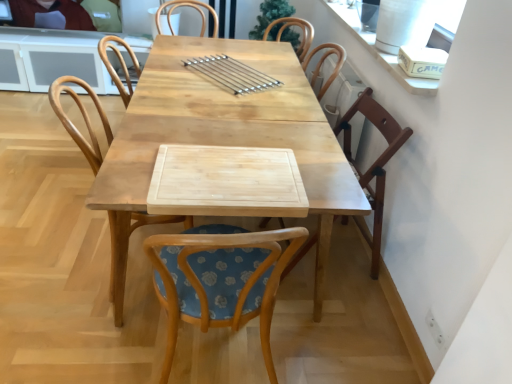
Question: Which direction should I rotate to look at wooden chair at center, which is the third chair from right to left?

Choices:
 (A) left
 (B) right

Answer: (A)

Question: Considering the relative sizes of wooden chair at center, which is the third chair from right to left, and woodenchair at center, which is the 2th chair in left-to-right order, in the image provided, is wooden chair at center, which is the third chair from right to left, smaller than woodenchair at center, which is the 2th chair in left-to-right order,?

Choices:
 (A) no
 (B) yes

Answer: (A)

Question: Can you confirm if wooden chair at center, which is the third chair from right to left, is wider than woodenchair at center, which is counted as the 2th chair, starting from the right?

Choices:
 (A) yes
 (B) no

Answer: (B)

Question: Is wooden chair at center, which is the third chair from right to left, not within woodenchair at center, which is counted as the 2th chair, starting from the right?

Choices:
 (A) yes
 (B) no

Answer: (A)

Question: From a real-world perspective, is wooden chair at center, which is counted as the first chair, starting from the left, physically below woodenchair at center, which is counted as the 2th chair, starting from the right?

Choices:
 (A) no
 (B) yes

Answer: (B)

Question: Considering the relative positions of wooden chair at center, which is the third chair from right to left, and woodenchair at center, which is the 2th chair in left-to-right order, in the image provided, is wooden chair at center, which is the third chair from right to left, to the right of woodenchair at center, which is the 2th chair in left-to-right order, from the viewer's perspective?

Choices:
 (A) yes
 (B) no

Answer: (B)

Question: Could woodenchair at center, which is the 2th chair in left-to-right order, be considered to be inside wooden chair at center, which is counted as the first chair, starting from the left?

Choices:
 (A) yes
 (B) no

Answer: (B)

Question: Is wooden chair at right, positioned as the third chair in left-to-right order, at the back of matte black laptop at upper left?

Choices:
 (A) no
 (B) yes

Answer: (A)

Question: Can you confirm if matte black laptop at upper left is taller than wooden chair at right, which ranks as the 1th chair in right-to-left order?

Choices:
 (A) yes
 (B) no

Answer: (B)

Question: Does matte black laptop at upper left lie in front of wooden chair at right, which ranks as the 1th chair in right-to-left order?

Choices:
 (A) no
 (B) yes

Answer: (A)

Question: Does matte black laptop at upper left have a lesser height compared to wooden chair at right, positioned as the third chair in left-to-right order?

Choices:
 (A) no
 (B) yes

Answer: (B)

Question: Is matte black laptop at upper left not within wooden chair at right, positioned as the third chair in left-to-right order?

Choices:
 (A) yes
 (B) no

Answer: (A)

Question: From the image's perspective, is matte black laptop at upper left on top of wooden chair at right, positioned as the third chair in left-to-right order?

Choices:
 (A) yes
 (B) no

Answer: (A)

Question: Can you confirm if wooden chair at right, positioned as the third chair in left-to-right order, is thinner than satin silver skewers at center?

Choices:
 (A) yes
 (B) no

Answer: (B)